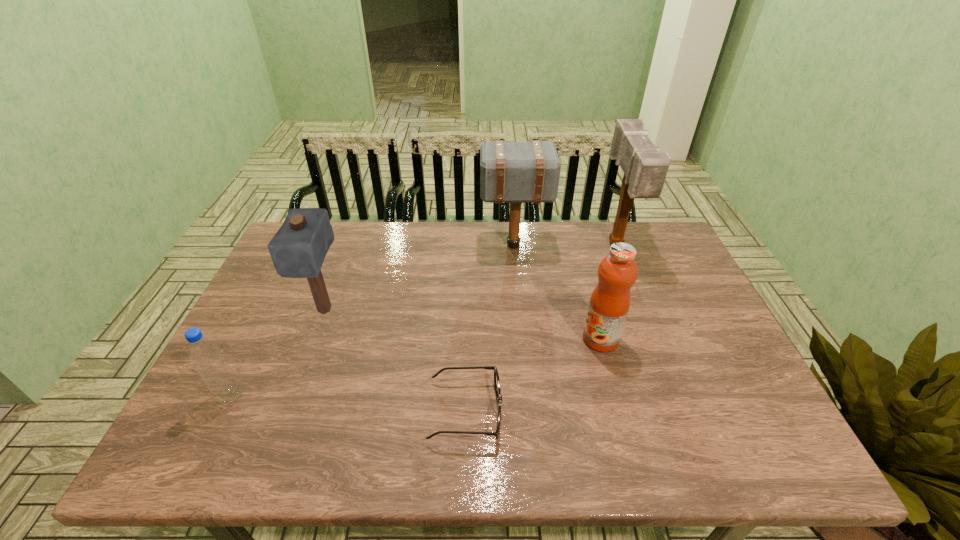
What are the coordinates of `vacant space situated 0.110m on the striking surface of the second mallet from left to right` in the screenshot? It's located at (447, 245).

Locate an element on the screen. This screenshot has width=960, height=540. free location located on the striking surface of the second mallet from left to right is located at coordinates (387, 245).

Find the location of a particular element. The height and width of the screenshot is (540, 960). vacant area situated on the right of the leftmost mallet is located at coordinates (364, 310).

At what (x,y) coordinates should I click in order to perform the action: click on vacant space located on the front label of the second object from right to left. Please return your answer as a coordinate pair (x, y). Looking at the image, I should click on (491, 339).

Locate an element on the screen. The height and width of the screenshot is (540, 960). free spot located on the front label of the second object from right to left is located at coordinates (548, 339).

I want to click on free space located on the front label of the second object from right to left, so click(498, 339).

This screenshot has height=540, width=960. I want to click on free spot located on the right of the second shortest object, so click(x=266, y=396).

This screenshot has width=960, height=540. Find the location of `free location located 0.340m on the front-facing side of the spectacles`. free location located 0.340m on the front-facing side of the spectacles is located at coordinates (653, 411).

Locate an element on the screen. The height and width of the screenshot is (540, 960). object that is at the near edge is located at coordinates (496, 376).

This screenshot has height=540, width=960. I want to click on mallet at the left edge, so [298, 249].